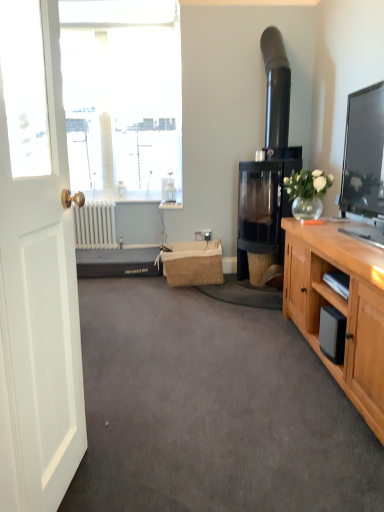
Question: Should I look upward or downward to see burlap picnic basket at center?

Choices:
 (A) up
 (B) down

Answer: (B)

Question: Considering the relative sizes of gray carpet at center and white matte radiator at lower left in the image provided, is gray carpet at center bigger than white matte radiator at lower left?

Choices:
 (A) no
 (B) yes

Answer: (B)

Question: Does gray carpet at center have a lesser width compared to white matte radiator at lower left?

Choices:
 (A) yes
 (B) no

Answer: (B)

Question: Can you confirm if gray carpet at center is wider than white matte radiator at lower left?

Choices:
 (A) no
 (B) yes

Answer: (B)

Question: From a real-world perspective, does gray carpet at center sit lower than white matte radiator at lower left?

Choices:
 (A) yes
 (B) no

Answer: (A)

Question: From a real-world perspective, is gray carpet at center over white matte radiator at lower left?

Choices:
 (A) yes
 (B) no

Answer: (B)

Question: Would you say gray carpet at center contains white matte radiator at lower left?

Choices:
 (A) yes
 (B) no

Answer: (B)

Question: From a real-world perspective, is white matte radiator at lower left below translucent glass vase at upper right?

Choices:
 (A) no
 (B) yes

Answer: (B)

Question: From the image's perspective, is white matte radiator at lower left below translucent glass vase at upper right?

Choices:
 (A) yes
 (B) no

Answer: (A)

Question: Is white matte radiator at lower left taller than translucent glass vase at upper right?

Choices:
 (A) no
 (B) yes

Answer: (B)

Question: Is white matte radiator at lower left shorter than translucent glass vase at upper right?

Choices:
 (A) yes
 (B) no

Answer: (B)

Question: Considering the relative positions of white matte radiator at lower left and translucent glass vase at upper right in the image provided, is white matte radiator at lower left behind translucent glass vase at upper right?

Choices:
 (A) no
 (B) yes

Answer: (B)

Question: Are white matte radiator at lower left and translucent glass vase at upper right located far from each other?

Choices:
 (A) yes
 (B) no

Answer: (A)

Question: Would you say burlap picnic basket at center contains black glass fireplace at center-right?

Choices:
 (A) no
 (B) yes

Answer: (A)